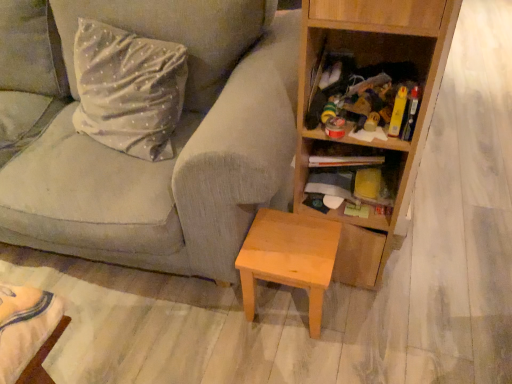
Image resolution: width=512 pixels, height=384 pixels. Find the location of `free location above light brown wood stool at lower center (from a real-world perspective)`. free location above light brown wood stool at lower center (from a real-world perspective) is located at coordinates pyautogui.click(x=295, y=236).